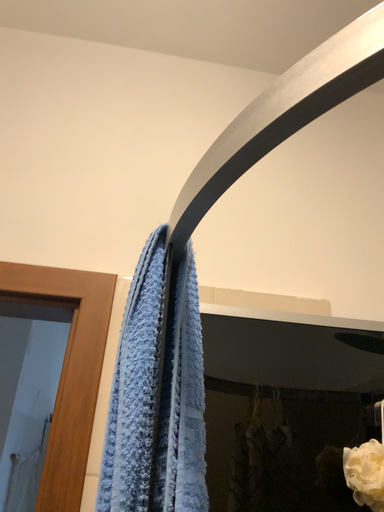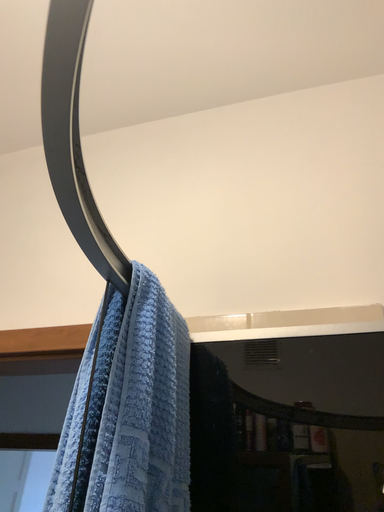
Question: How did the camera likely rotate when shooting the video?

Choices:
 (A) rotated left
 (B) rotated right

Answer: (A)